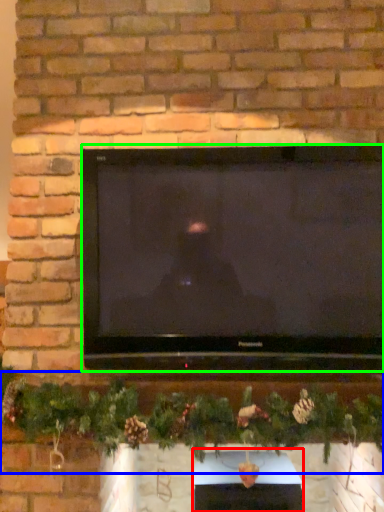
Question: Based on their relative distances, which object is farther from fireplace (highlighted by a red box)? Choose from christmas decoration (highlighted by a blue box) and television (highlighted by a green box).

Choices:
 (A) christmas decoration
 (B) television

Answer: (B)